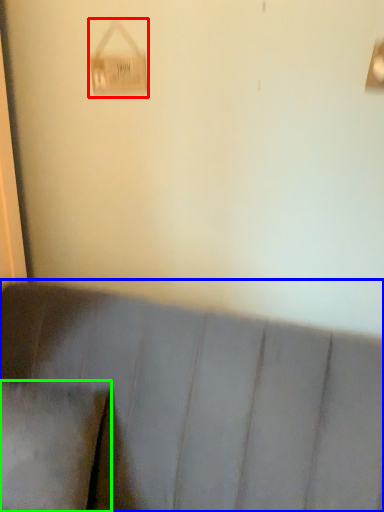
Question: Which object is the closest to the lamp (highlighted by a red box)? Choose among these: furniture (highlighted by a blue box) or pillow (highlighted by a green box).

Choices:
 (A) furniture
 (B) pillow

Answer: (A)